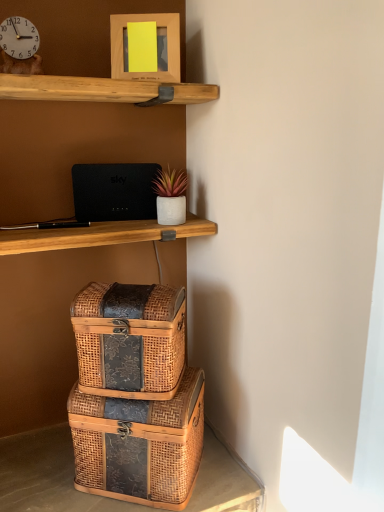
Based on the photo, what is the approximate width of black matte router at upper center?

black matte router at upper center is 1.22 inches wide.

Locate an element on the screen. This screenshot has height=512, width=384. woven wood box at lower center, positioned as the 1th box in top-to-bottom order is located at coordinates (130, 340).

The height and width of the screenshot is (512, 384). What do you see at coordinates (168, 46) in the screenshot? I see `wooden picture frame at upper center` at bounding box center [168, 46].

Measure the distance between wooden picture frame at upper center and camera.

1.09 meters.

The image size is (384, 512). Describe the element at coordinates (45, 475) in the screenshot. I see `woven wood trunk at lower center` at that location.

Where is `black matte router at upper center`? The image size is (384, 512). black matte router at upper center is located at coordinates (114, 191).

Considering the positions of objects woven wood box at center, the first box when ordered from bottom to top, and black matte router at upper center in the image provided, who is in front, woven wood box at center, the first box when ordered from bottom to top, or black matte router at upper center?

woven wood box at center, the first box when ordered from bottom to top, is more forward.

Could you tell me if woven wood box at center, the first box when ordered from bottom to top, is facing black matte router at upper center?

No, woven wood box at center, the first box when ordered from bottom to top, is not aimed at black matte router at upper center.

Can you confirm if woven wood box at center, the first box when ordered from bottom to top, is positioned to the left of black matte router at upper center?

No, woven wood box at center, the first box when ordered from bottom to top, is not to the left of black matte router at upper center.

Consider the image. Could you measure the distance between woven wood box at center, the first box when ordered from bottom to top, and black matte router at upper center?

The distance of woven wood box at center, the first box when ordered from bottom to top, from black matte router at upper center is 59.24 centimeters.

Does white glossy clock at upper left have a larger size compared to wooden picture frame at upper center?

No.

Is there a large distance between white glossy clock at upper left and wooden picture frame at upper center?

That's not correct — white glossy clock at upper left is a little close to wooden picture frame at upper center.

From a real-world perspective, is white glossy clock at upper left positioned over wooden picture frame at upper center based on gravity?

No, from a real-world perspective, white glossy clock at upper left is not on top of wooden picture frame at upper center.

Is woven wood box at lower center, which ranks as the 2th box in bottom-to-top order, closer to the viewer compared to black matte router at upper center?

Yes.

From the image's perspective, would you say woven wood box at lower center, positioned as the 1th box in top-to-bottom order, is positioned over black matte router at upper center?

No.

Which of these two, woven wood box at lower center, which ranks as the 2th box in bottom-to-top order, or black matte router at upper center, stands taller?

woven wood box at lower center, which ranks as the 2th box in bottom-to-top order, is taller.

From a real-world perspective, is woven wood box at lower center, which ranks as the 2th box in bottom-to-top order, above or below black matte router at upper center?

woven wood box at lower center, which ranks as the 2th box in bottom-to-top order, is situated lower than black matte router at upper center in the real world.

Which of these two, black matte router at upper center or wooden picture frame at upper center, is wider?

Wider between the two is wooden picture frame at upper center.

Considering the sizes of black matte router at upper center and wooden picture frame at upper center in the image, is black matte router at upper center bigger or smaller than wooden picture frame at upper center?

Considering their sizes, black matte router at upper center takes up less space than wooden picture frame at upper center.

From a real-world perspective, is black matte router at upper center under wooden picture frame at upper center?

Correct, in the physical world, black matte router at upper center is lower than wooden picture frame at upper center.

Relative to wooden picture frame at upper center, is black matte router at upper center in front or behind?

Visually, black matte router at upper center is located behind wooden picture frame at upper center.

Considering the sizes of wooden picture frame at upper center and woven wood box at center, which appears as the second box when viewed from the top, in the image, is wooden picture frame at upper center taller or shorter than woven wood box at center, which appears as the second box when viewed from the top,?

wooden picture frame at upper center is shorter than woven wood box at center, which appears as the second box when viewed from the top.

Is point (127, 72) closer or farther from the camera than point (143, 496)?

Point (127, 72) is farther from the camera than point (143, 496).

Is wooden picture frame at upper center oriented away from woven wood box at center, the first box when ordered from bottom to top?

No, wooden picture frame at upper center's orientation is not away from woven wood box at center, the first box when ordered from bottom to top.

Based on the photo, considering the sizes of objects white glossy clock at upper left and black matte router at upper center in the image provided, who is shorter, white glossy clock at upper left or black matte router at upper center?

Standing shorter between the two is white glossy clock at upper left.

Who is smaller, white glossy clock at upper left or black matte router at upper center?

white glossy clock at upper left.

Is white glossy clock at upper left placed right next to black matte router at upper center?

No, white glossy clock at upper left is not making contact with black matte router at upper center.

From a real-world perspective, relative to white glossy clock at upper left, is woven wood trunk at lower center vertically above or below?

woven wood trunk at lower center is situated lower than white glossy clock at upper left in the real world.

This screenshot has width=384, height=512. Identify the location of desk on the right side of white glossy clock at upper left. (45, 475).

Can you confirm if woven wood trunk at lower center is bigger than white glossy clock at upper left?

Yes.

Where is `laptop above the woven wood box at center, the first box when ordered from bottom to top (from the image's perspective)`? The image size is (384, 512). laptop above the woven wood box at center, the first box when ordered from bottom to top (from the image's perspective) is located at coordinates (114, 191).

In the image, there is a wooden picture frame at upper center. Identify the location of clock below it (from the image's perspective). The width and height of the screenshot is (384, 512). (19, 37).

Based on their spatial positions, is white glossy clock at upper left or woven wood trunk at lower center closer to black matte router at upper center?

white glossy clock at upper left is positioned closer to the anchor black matte router at upper center.

Considering their positions, is wooden picture frame at upper center positioned further to woven wood trunk at lower center than white glossy clock at upper left?

white glossy clock at upper left lies further to woven wood trunk at lower center than the other object.

From the image, which object appears to be farther from woven wood box at center, which appears as the second box when viewed from the top, white glossy clock at upper left or wooden picture frame at upper center?

white glossy clock at upper left is further to woven wood box at center, which appears as the second box when viewed from the top.

Looking at this image, from the image, which object appears to be farther from black matte router at upper center, woven wood box at lower center, which ranks as the 2th box in bottom-to-top order, or woven wood trunk at lower center?

Among the two, woven wood trunk at lower center is located further to black matte router at upper center.

When comparing their distances from woven wood trunk at lower center, does white glossy clock at upper left or woven wood box at center, the first box when ordered from bottom to top, seem further?

white glossy clock at upper left is positioned further to the anchor woven wood trunk at lower center.

When comparing their distances from white glossy clock at upper left, does woven wood box at lower center, which ranks as the 2th box in bottom-to-top order, or black matte router at upper center seem further?

Based on the image, woven wood box at lower center, which ranks as the 2th box in bottom-to-top order, appears to be further to white glossy clock at upper left.

Which object lies further to the anchor point black matte router at upper center, woven wood box at center, which appears as the second box when viewed from the top, or wooden picture frame at upper center?

woven wood box at center, which appears as the second box when viewed from the top, is positioned further to the anchor black matte router at upper center.

Estimate the real-world distances between objects in this image. Which object is further from woven wood trunk at lower center, woven wood box at center, which appears as the second box when viewed from the top, or woven wood box at lower center, which ranks as the 2th box in bottom-to-top order?

→ Based on the image, woven wood box at lower center, which ranks as the 2th box in bottom-to-top order, appears to be further to woven wood trunk at lower center.

The height and width of the screenshot is (512, 384). I want to click on box between white glossy clock at upper left and woven wood box at center, which appears as the second box when viewed from the top, from top to bottom, so click(130, 340).

This screenshot has height=512, width=384. I want to click on laptop between white glossy clock at upper left and woven wood trunk at lower center vertically, so click(x=114, y=191).

Identify the location of laptop between wooden picture frame at upper center and woven wood box at lower center, which ranks as the 2th box in bottom-to-top order, vertically. This screenshot has height=512, width=384. (114, 191).

Where is `clock that lies between wooden picture frame at upper center and black matte router at upper center from top to bottom`? clock that lies between wooden picture frame at upper center and black matte router at upper center from top to bottom is located at coordinates (19, 37).